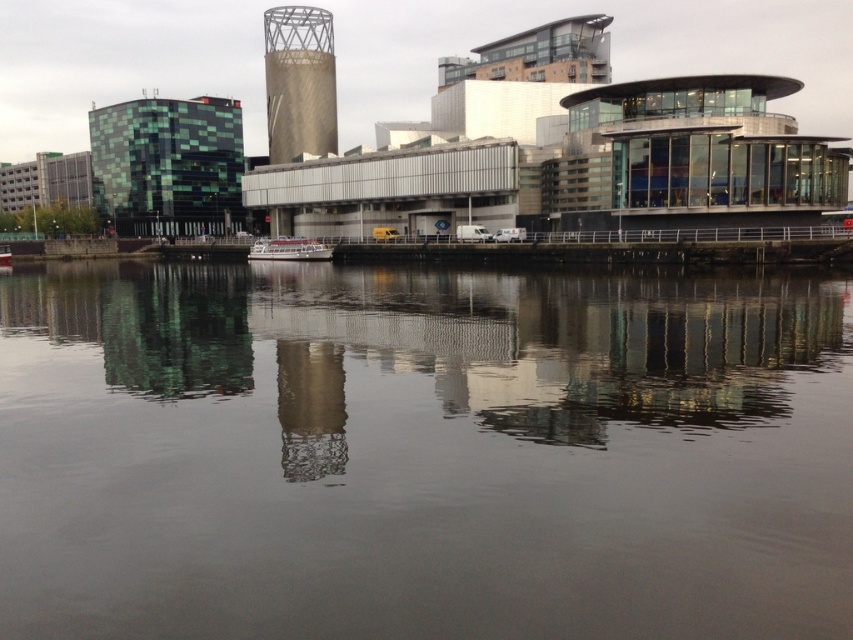
You are a tour guide explaining the waterfront area to visitors. You mention the transparent water at center and the gold textured tower at center. How far apart are these two landmarks in feet?

The transparent water at center and the gold textured tower at center are 338.83 feet apart.

You are a tourist standing at the waterfront and want to take a photo of both the transparent water at center and the gold textured tower at center. Which object will appear taller in your photo?

The gold textured tower at center will appear taller in the photo because the transparent water at center has a lesser height compared to it.

You are a photographer planning to capture the waterfront scene. You want to ensure that both the transparent water at center and the gold textured tower at center are clearly visible in your shot. Given their sizes, which object will occupy more of the frame?

The transparent water at center has a larger size compared to the gold textured tower at center, so it will occupy more of the frame in the photograph.